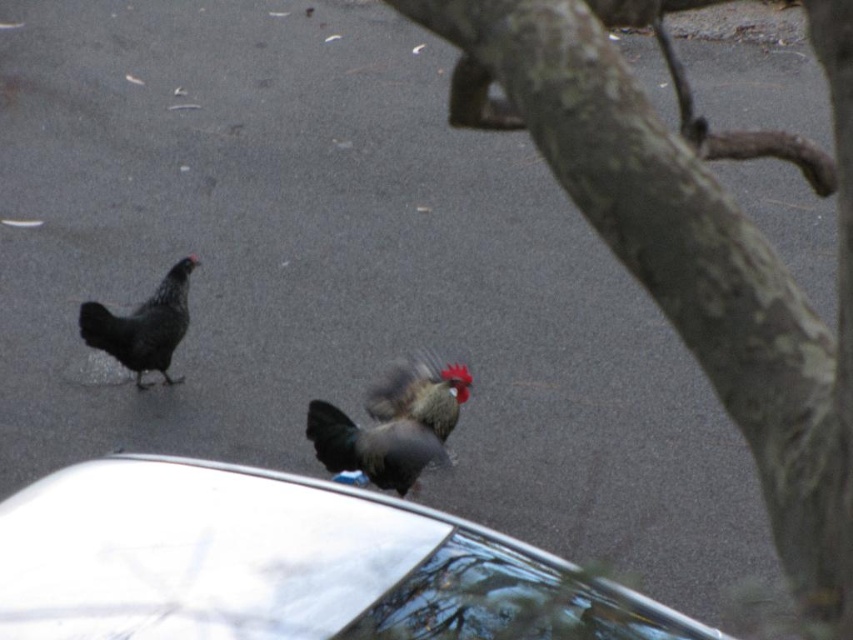
Question: Is white glossy car at lower left below transparent glass car window at lower center?

Choices:
 (A) no
 (B) yes

Answer: (A)

Question: Which object is positioned farthest from the black matte chicken at left?

Choices:
 (A) shiny brown rooster at center
 (B) white glossy car at lower left

Answer: (B)

Question: Which point is farther to the camera?

Choices:
 (A) (364, 404)
 (B) (479, 579)
 (C) (195, 524)
 (D) (848, 188)

Answer: (A)

Question: Which point is farther to the camera?

Choices:
 (A) white glossy car at lower left
 (B) shiny brown rooster at center
 (C) black matte chicken at left
 (D) transparent glass car window at lower center

Answer: (C)

Question: Is white glossy car at lower left to the left of shiny brown rooster at center from the viewer's perspective?

Choices:
 (A) no
 (B) yes

Answer: (B)

Question: Is transparent glass car window at lower center closer to the viewer compared to black matte chicken at left?

Choices:
 (A) yes
 (B) no

Answer: (A)